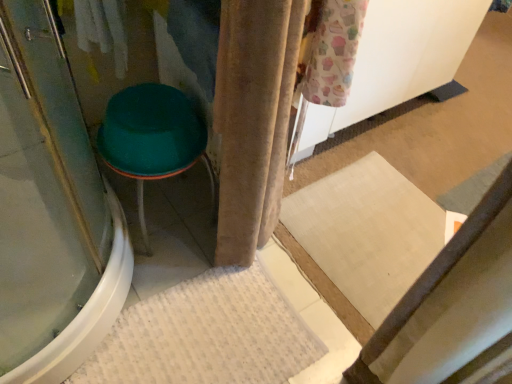
Identify the location of free space that is in between beige velvet curtain at center and white textured bath mat at lower center. This screenshot has width=512, height=384. (168, 264).